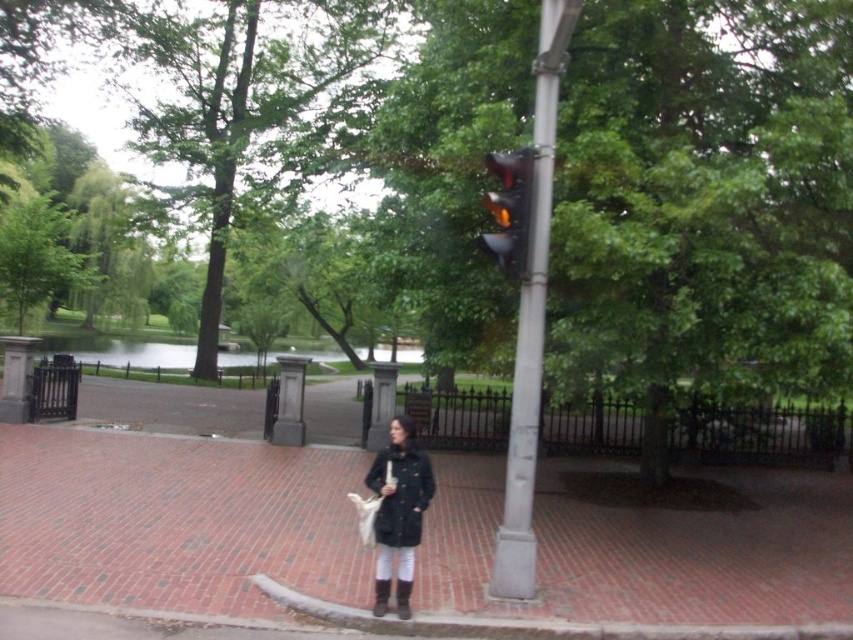
Does metallic gray traffic light at center come in front of matte black coat at center?

That is False.

Between metallic gray traffic light at center and matte black coat at center, which one is positioned lower?

matte black coat at center

Where is `metallic gray traffic light at center`? The image size is (853, 640). metallic gray traffic light at center is located at coordinates (531, 321).

Image resolution: width=853 pixels, height=640 pixels. In order to click on metallic gray traffic light at center in this screenshot , I will do (531, 321).

Does brick pavement at center appear over yellow glass traffic light at upper center?

No.

Locate an element on the screen. The width and height of the screenshot is (853, 640). brick pavement at center is located at coordinates (175, 520).

Is point (465, 547) positioned after point (525, 152)?

Yes, it is.

What are the coordinates of `brick pavement at center` in the screenshot? It's located at (175, 520).

Is metallic gray traffic light at center positioned behind yellow glass traffic light at upper center?

No, metallic gray traffic light at center is closer to the viewer.

Which is below, metallic gray traffic light at center or yellow glass traffic light at upper center?

metallic gray traffic light at center is below.

Which is behind, point (526, 333) or point (502, 244)?

Positioned behind is point (526, 333).

Where is `metallic gray traffic light at center`? metallic gray traffic light at center is located at coordinates (531, 321).